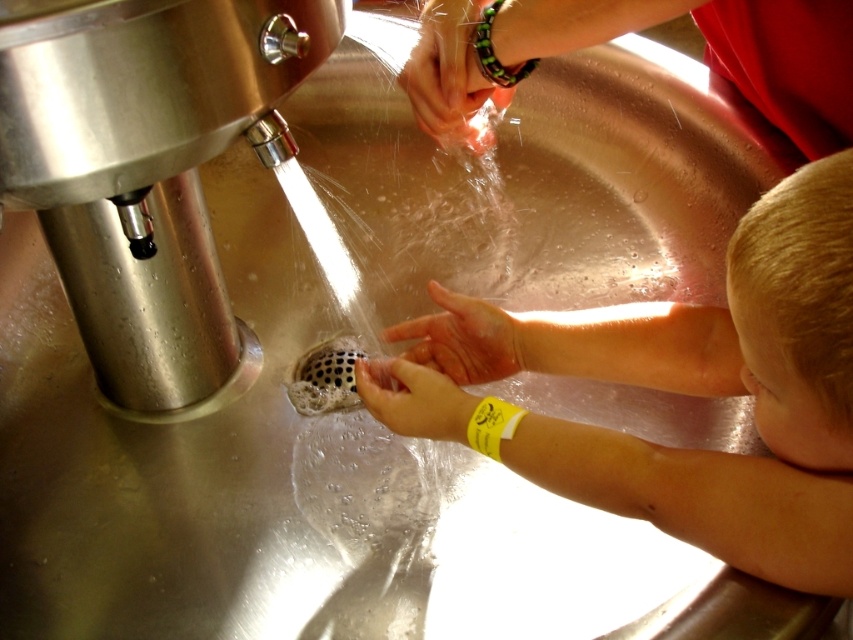
You are a person with a 30 cm long arm. You want to wash your hands at the sink shown in the image. Can your hands reach the smooth skin hands at center?

The distance between the smooth skin hands at center and the viewer is 37.95 centimeters. Since your arm is 30 cm long, you cannot reach the smooth skin hands at center as your arm is shorter than the distance required.